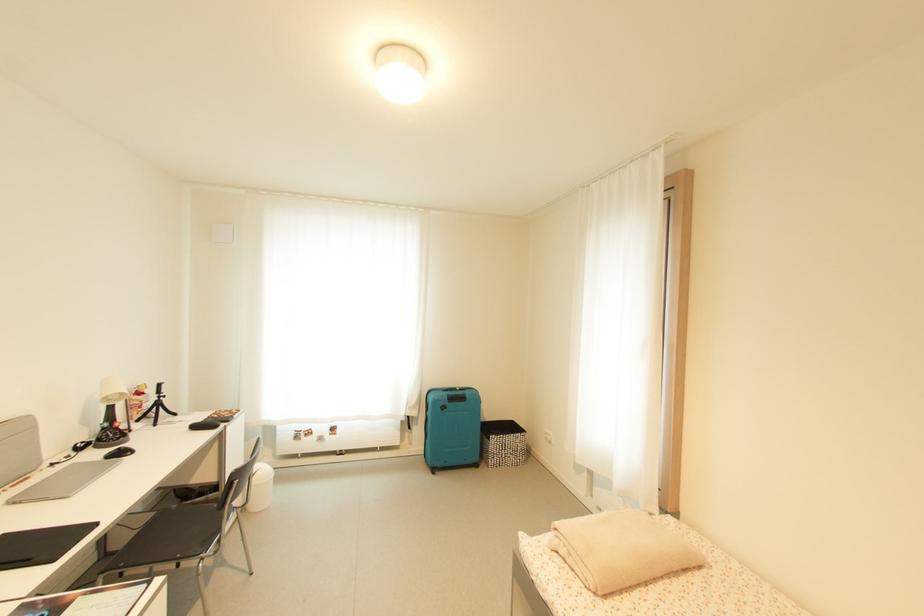
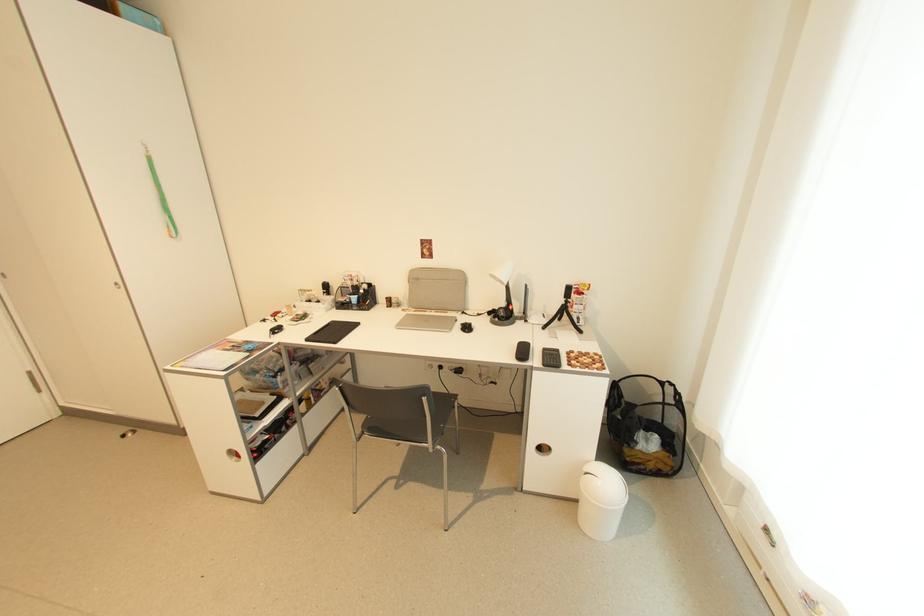
The point at (261,515) is marked in the first image. Where is the corresponding point in the second image?

(581, 524)